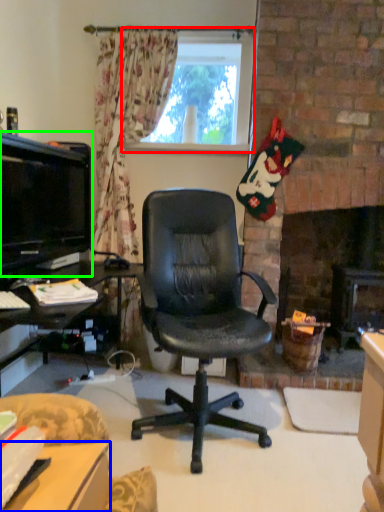
Question: Which object is positioned farthest from window (highlighted by a red box)? Select from desk (highlighted by a blue box) and television (highlighted by a green box).

Choices:
 (A) desk
 (B) television

Answer: (A)